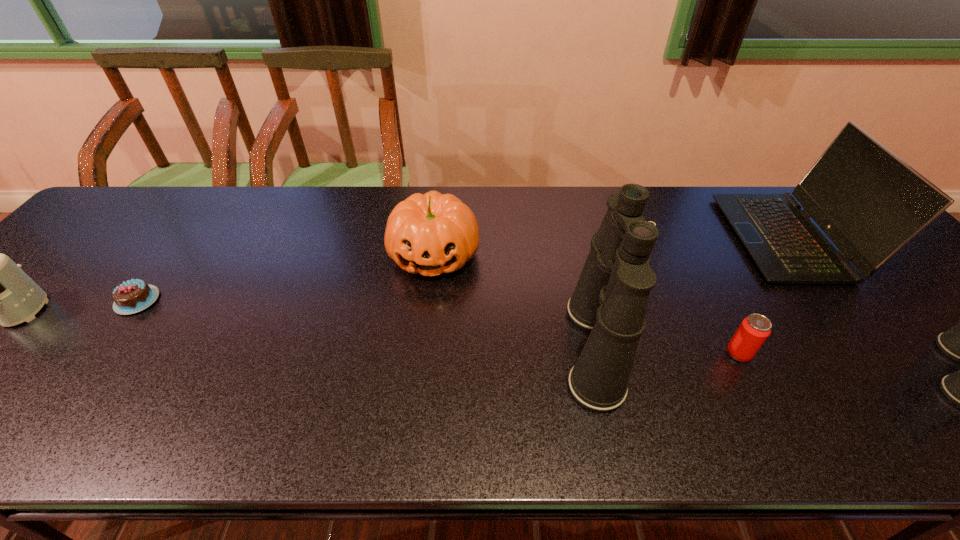
What are the coordinates of `free point located 0.240m on the screen of the laptop computer` in the screenshot? It's located at (649, 238).

Identify the location of free space located 0.270m on the screen of the laptop computer. (638, 238).

In order to click on free space located 0.080m on the screen of the laptop computer in this screenshot , I will do `click(707, 238)`.

You are a GUI agent. You are given a task and a screenshot of the screen. Output one action in this format:
    pyautogui.click(x=<x>, y=<y>)
    Task: Click on the vacant space located on the carved face of the pumpkin
    This screenshot has width=960, height=540.
    Given the screenshot: What is the action you would take?
    pyautogui.click(x=425, y=331)

The width and height of the screenshot is (960, 540). What are the coordinates of `vacant space located 0.110m on the left of the sixth object from right to left` in the screenshot? It's located at (72, 301).

Locate an element on the screen. free space located on the left of the second shortest object is located at coordinates (689, 354).

You are a GUI agent. You are given a task and a screenshot of the screen. Output one action in this format:
    pyautogui.click(x=<x>, y=<y>)
    Task: Click on the laptop computer that is at the far edge
    This screenshot has width=960, height=540.
    Given the screenshot: What is the action you would take?
    pyautogui.click(x=870, y=203)

Where is `pumpkin present at the far edge`? This screenshot has height=540, width=960. pumpkin present at the far edge is located at coordinates (432, 233).

Where is `binoculars that is at the near edge`? binoculars that is at the near edge is located at coordinates (610, 300).

This screenshot has width=960, height=540. Identify the location of beer can at the near edge. (753, 331).